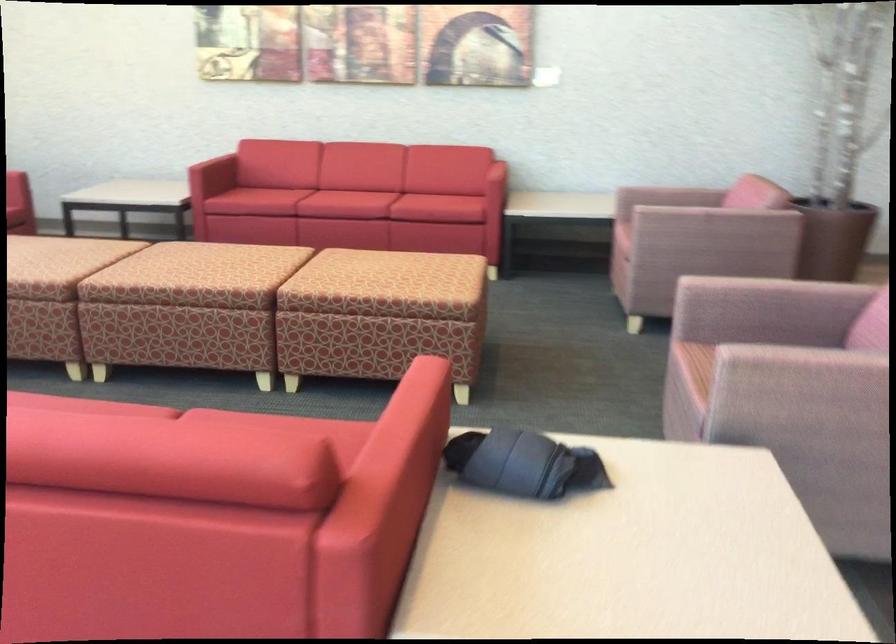
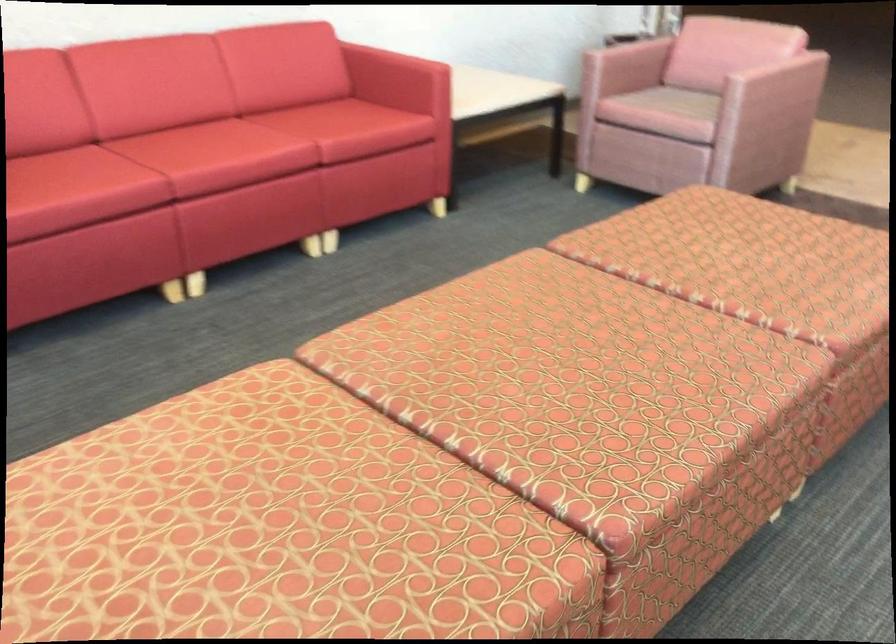
In the second image, find the point that corresponds to (x=719, y=223) in the first image.

(773, 90)